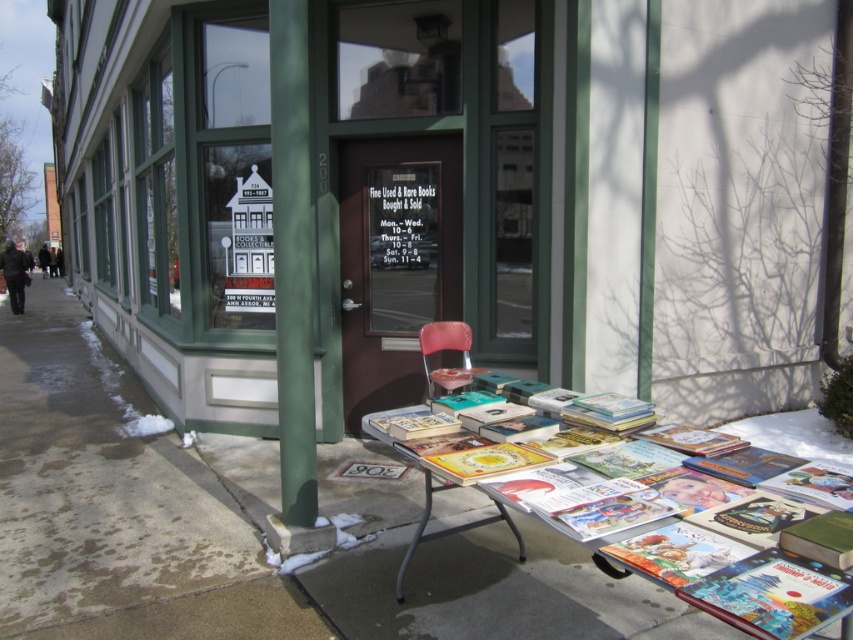
Question: Which of the following is the farthest from the observer?

Choices:
 (A) (456, 378)
 (B) (67, 422)

Answer: (B)

Question: Among these points, which one is nearest to the camera?

Choices:
 (A) (639, 624)
 (B) (308, 196)

Answer: (A)

Question: Based on their relative distances, which object is farther from the wooden door at center?

Choices:
 (A) metallic silver table at lower center
 (B) smooth concrete pavement at lower center
 (C) pink plastic chair at center

Answer: (A)

Question: Does wooden door at center appear under smooth concrete pavement at lower center?

Choices:
 (A) yes
 (B) no

Answer: (B)

Question: Can you confirm if wooden door at center is positioned to the left of pink plastic chair at center?

Choices:
 (A) no
 (B) yes

Answer: (B)

Question: Can you confirm if green matte pole at center is wider than pink plastic chair at center?

Choices:
 (A) no
 (B) yes

Answer: (A)